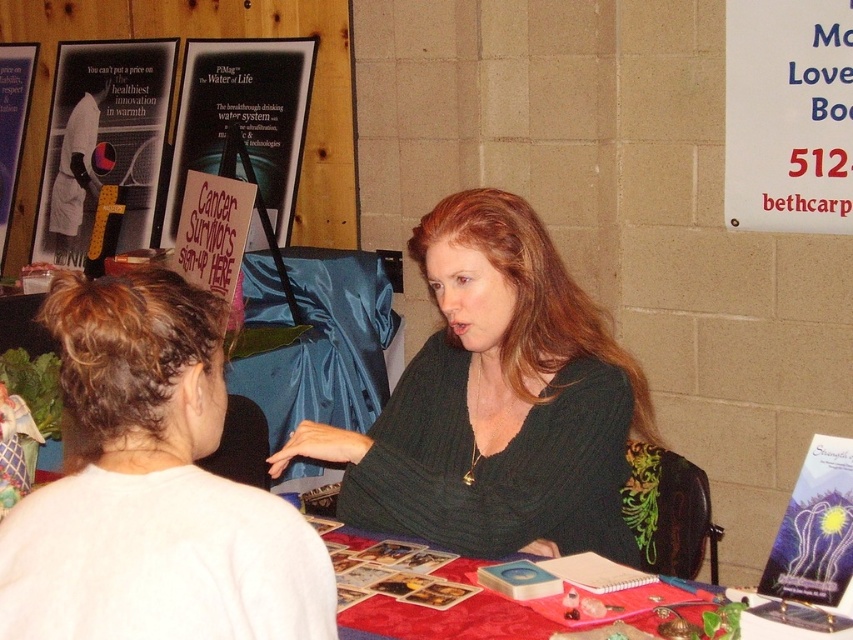
Is white paper sign at upper left further to the viewer compared to metallic silver poster at lower right?

Yes, it is.

Is point (308, 205) positioned behind point (844, 556)?

Yes, point (308, 205) is farther from viewer.

Between point (126, 28) and point (849, 493), which one is positioned behind?

Point (126, 28)

You are a GUI agent. You are given a task and a screenshot of the screen. Output one action in this format:
    pyautogui.click(x=<x>, y=<y>)
    Task: Click on the white paper sign at upper left
    
    Given the screenshot: What is the action you would take?
    pyautogui.click(x=178, y=92)

Can you confirm if green knitted sweater at center is positioned below white paper sign at upper right?

Indeed, green knitted sweater at center is positioned under white paper sign at upper right.

Between point (590, 476) and point (815, 132), which one is positioned in front?

Point (590, 476)

Identify the location of green knitted sweater at center. (495, 401).

Does matte black tennis racket at upper left have a lesser height compared to red fabric table at center?

Incorrect, matte black tennis racket at upper left's height does not fall short of red fabric table at center's.

Is point (122, 54) in front of point (364, 625)?

No, (122, 54) is behind (364, 625).

Locate an element on the screen. This screenshot has width=853, height=640. matte black tennis racket at upper left is located at coordinates point(103,141).